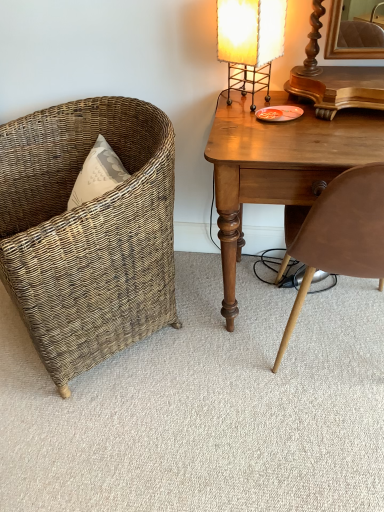
The image size is (384, 512). What are the coordinates of `vacant space that is to the left of wooden desk at right` in the screenshot? It's located at (192, 335).